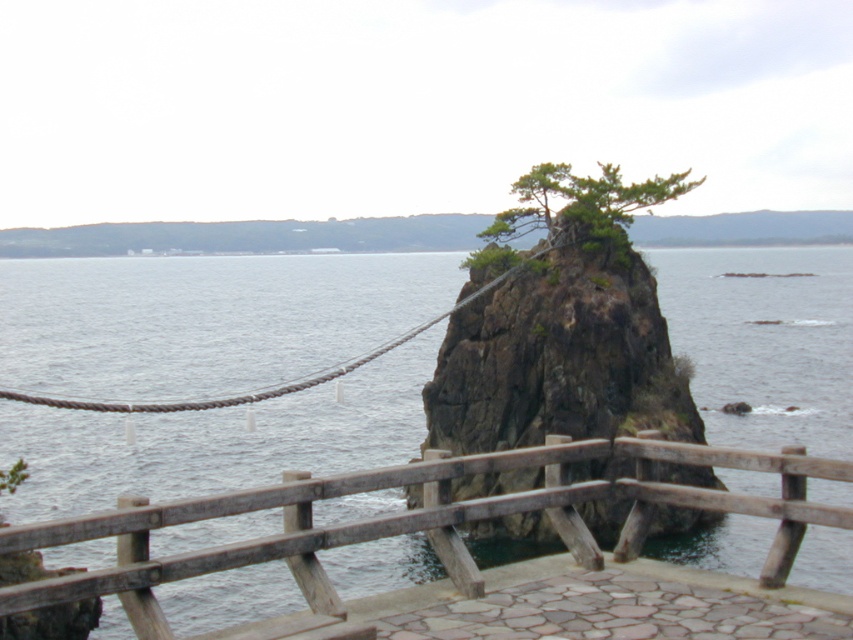
Can you confirm if wooden rail at center is shorter than green rough textured tree at center?

Yes.

Is wooden rail at center taller than green rough textured tree at center?

No, wooden rail at center is not taller than green rough textured tree at center.

Which is in front, point (763, 465) or point (552, 236)?

Point (763, 465) is more forward.

Locate an element on the screen. The height and width of the screenshot is (640, 853). wooden rail at center is located at coordinates (422, 518).

Locate an element on the screen. rough textured rock at center is located at coordinates tap(560, 356).

Who is positioned more to the left, rough textured rock at center or green rough textured tree at center?

Positioned to the left is rough textured rock at center.

Where is `rough textured rock at center`? The image size is (853, 640). rough textured rock at center is located at coordinates (560, 356).

Who is positioned more to the left, wooden rail at center or rough textured rock at center?

Positioned to the left is wooden rail at center.

Is wooden rail at center behind rough textured rock at center?

No.

Is point (234, 548) farther from viewer compared to point (465, 452)?

That is False.

Identify the location of wooden rail at center. (422, 518).